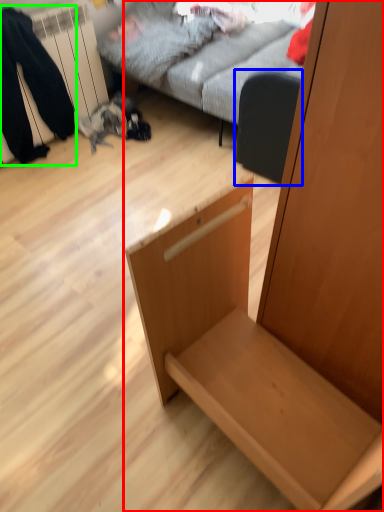
Question: Estimate the real-world distances between objects in this image. Which object is farther from furniture (highlighted by a red box), swivel chair (highlighted by a blue box) or couple (highlighted by a green box)?

Choices:
 (A) swivel chair
 (B) couple

Answer: (B)